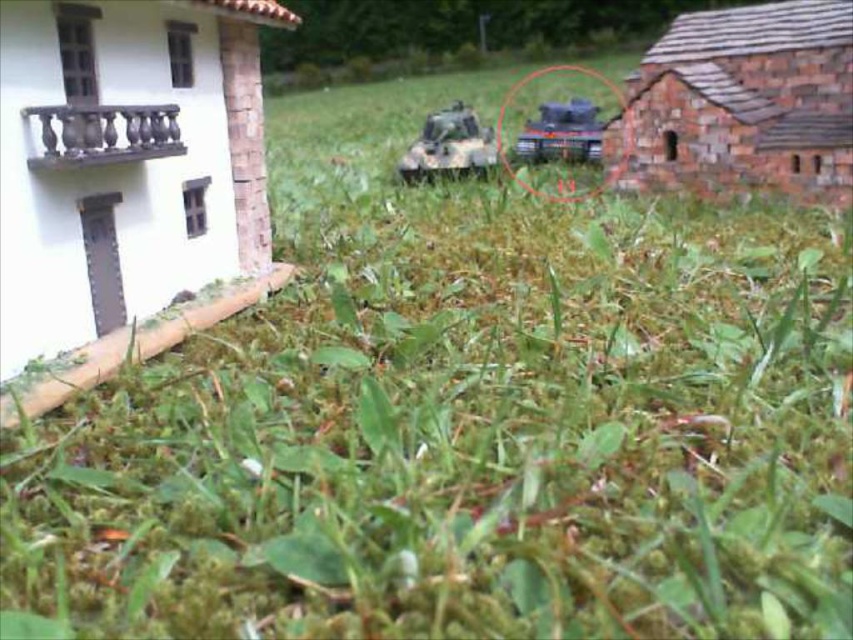
Who is positioned more to the right, camouflage plastic tank at center or brushed metal tank at center?

From the viewer's perspective, brushed metal tank at center appears more on the right side.

Does camouflage plastic tank at center have a smaller size compared to brushed metal tank at center?

No.

What do you see at coordinates (450, 145) in the screenshot? This screenshot has height=640, width=853. I see `camouflage plastic tank at center` at bounding box center [450, 145].

Locate an element on the screen. camouflage plastic tank at center is located at coordinates (450, 145).